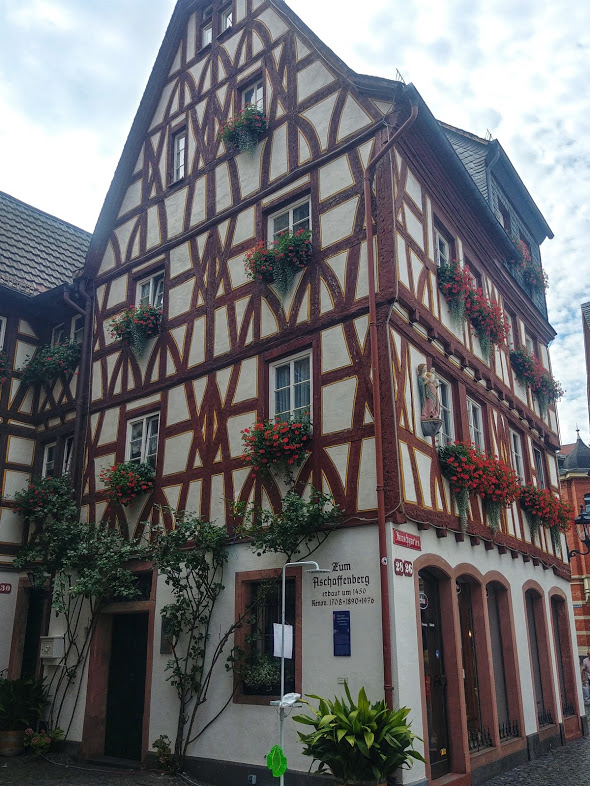
What are the coordinates of `doorway` in the screenshot? It's located at (140, 681).